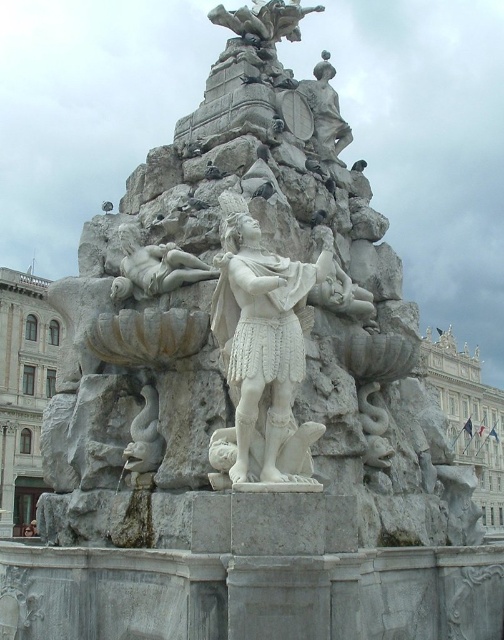
You are standing in the public square facing the grand marble fountain. You notice two points marked on the fountain. The first point is at coordinate point(124, 266) and the second is at point(318, 154). If you were to walk directly towards the fountain, which point would you encounter first?

Point(124, 266) is in front of point(318, 154), so you would encounter point(124, 266) first as you approach the fountain.

You are an art student analyzing the fountain sculptures. You notice the white marble statue at center and the white marble statue at upper center. Which one has a greater width?

The white marble statue at center has a greater width than the white marble statue at upper center.